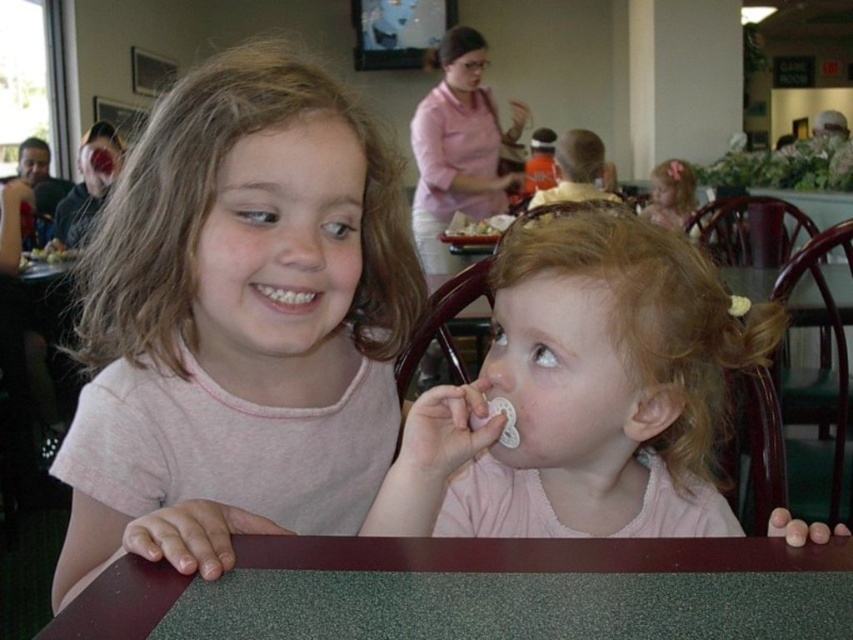
You are a photographer setting up for a family portrait in this dining area. You notice the smooth plastic spoon at upper right and the blonde curly hair at upper right. Which object should you adjust to avoid blocking the main subject, and why?

You should adjust the smooth plastic spoon at upper right because it is positioned above the blonde curly hair at upper right and might block the main subject if not moved.

You are a photographer taking a picture of the two children at the dining table. You want to ensure the pink fabric pacifier at center and the blonde curly hair at upper right are both clearly visible in the frame. Which object should you position closer to the left side of your camera viewfinder to achieve this?

The pink fabric pacifier at center should be positioned closer to the left side of the camera viewfinder because it is already located to the left of the blonde curly hair at upper right in the scene.

You are a photographer trying to capture the pacifier at center in the image. The pacifier is located at point coordinates of [585,374]. The camera you are using has a rectangular frame with a width of 0.8 and a height of 0.6. To ensure the pacifier is fully visible, what should be the minimum width and height of the camera frame you need to use?

The minimum width and height of the camera frame needed to fully capture the pacifier at center would be 0.8 and 0.6 respectively, as the camera frame already has those dimensions and the pacifier is positioned at point coordinates [585,374] within the image.